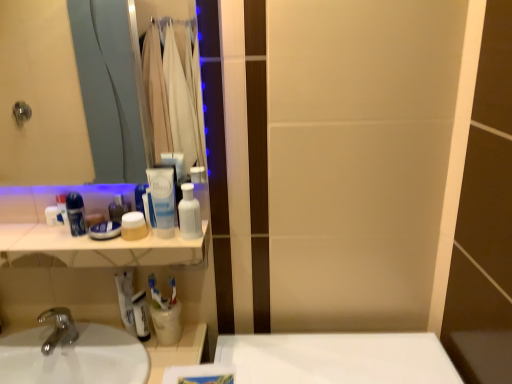
Find the location of a particular element. The height and width of the screenshot is (384, 512). vacant space underneath white glossy counter top at upper left (from a real-world perspective) is located at coordinates (100, 336).